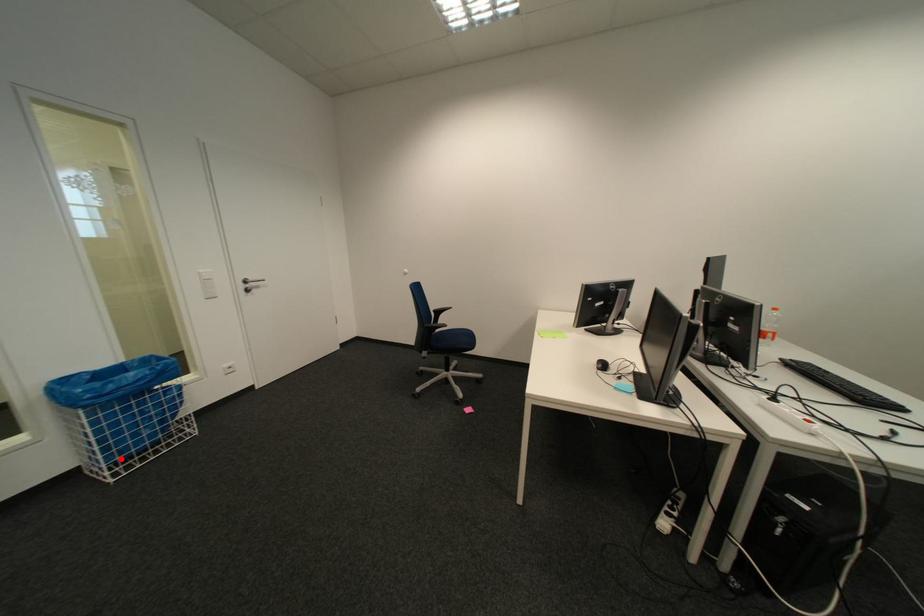
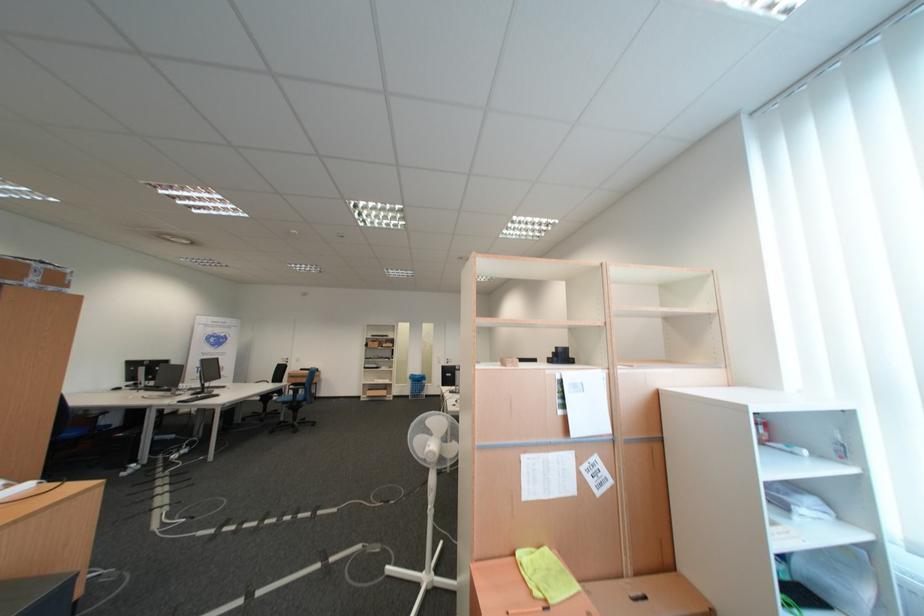
Question: I am providing you with two images of the same scene from different viewpoints. Image1 has a red point marked. In image2, the corresponding 3D location appears at what relative position? Reply with the corresponding letter.

Choices:
 (A) Closer
 (B) Farther

Answer: (B)